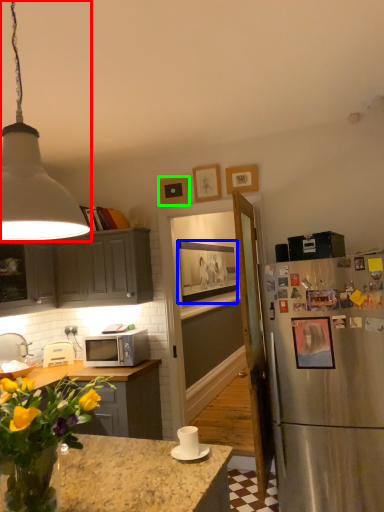
Question: Which is nearer to the lamp (highlighted by a red box)? picture frame (highlighted by a blue box) or picture frame (highlighted by a green box).

Choices:
 (A) picture frame
 (B) picture frame

Answer: (B)